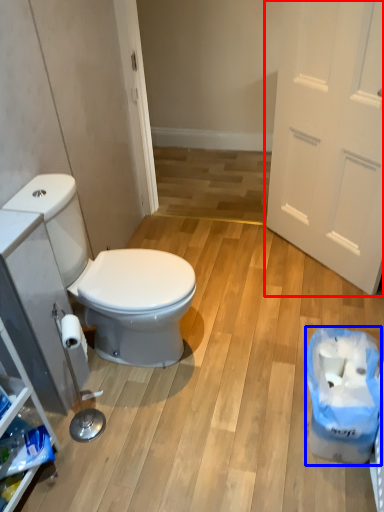
Question: Among these objects, which one is nearest to the camera, door (highlighted by a red box) or recycling bin (highlighted by a blue box)?

Choices:
 (A) door
 (B) recycling bin

Answer: (B)